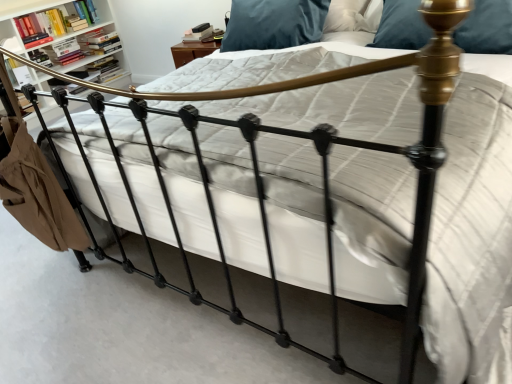
Question: Does hardcover book at upper left, which is the 2th book in back-to-front order, have a greater height compared to hardcover book at upper left, the first book viewed from the front?

Choices:
 (A) no
 (B) yes

Answer: (A)

Question: From a real-world perspective, is hardcover book at upper left, which is the 2th book in back-to-front order, positioned over hardcover book at upper left, the 4th book when ordered from back to front, based on gravity?

Choices:
 (A) yes
 (B) no

Answer: (B)

Question: Does hardcover book at upper left, which is the 2th book in back-to-front order, contain hardcover book at upper left, the 4th book when ordered from back to front?

Choices:
 (A) no
 (B) yes

Answer: (A)

Question: Considering the relative positions of hardcover book at upper left, the 3th book from the front, and hardcover book at upper left, the 4th book when ordered from back to front, in the image provided, is hardcover book at upper left, the 3th book from the front, to the right of hardcover book at upper left, the 4th book when ordered from back to front, from the viewer's perspective?

Choices:
 (A) yes
 (B) no

Answer: (A)

Question: From a real-world perspective, is hardcover book at upper left, the 3th book from the front, under hardcover book at upper left, the 4th book when ordered from back to front?

Choices:
 (A) no
 (B) yes

Answer: (B)

Question: Can you confirm if hardcover book at upper left, the 3th book from the front, is shorter than hardcover book at upper left, the 4th book when ordered from back to front?

Choices:
 (A) yes
 (B) no

Answer: (A)

Question: Can you confirm if hardcover book at upper left, which is the 3th book in back-to-front order, is smaller than hardcover books at upper left, placed as the fourth book when sorted from front to back?

Choices:
 (A) no
 (B) yes

Answer: (B)

Question: Could you tell me if hardcover book at upper left, which is the 3th book in back-to-front order, is facing hardcover books at upper left, which is counted as the 1th book, starting from the back?

Choices:
 (A) no
 (B) yes

Answer: (A)

Question: From a real-world perspective, is hardcover book at upper left, marked as the 2th book in a front-to-back arrangement, physically below hardcover books at upper left, placed as the fourth book when sorted from front to back?

Choices:
 (A) yes
 (B) no

Answer: (B)

Question: From the image's perspective, is hardcover book at upper left, marked as the 2th book in a front-to-back arrangement, on hardcover books at upper left, placed as the fourth book when sorted from front to back?

Choices:
 (A) yes
 (B) no

Answer: (A)

Question: Is hardcover book at upper left, marked as the 2th book in a front-to-back arrangement, far from hardcover books at upper left, placed as the fourth book when sorted from front to back?

Choices:
 (A) yes
 (B) no

Answer: (B)

Question: Can hardcover books at upper left, which is counted as the 1th book, starting from the back, be found inside hardcover book at upper left, which is the 3th book in back-to-front order?

Choices:
 (A) no
 (B) yes

Answer: (A)

Question: Considering the relative sizes of metallic bookshelf at upper left and hardcover books at upper left, which is counted as the 1th book, starting from the back, in the image provided, is metallic bookshelf at upper left thinner than hardcover books at upper left, which is counted as the 1th book, starting from the back,?

Choices:
 (A) yes
 (B) no

Answer: (B)